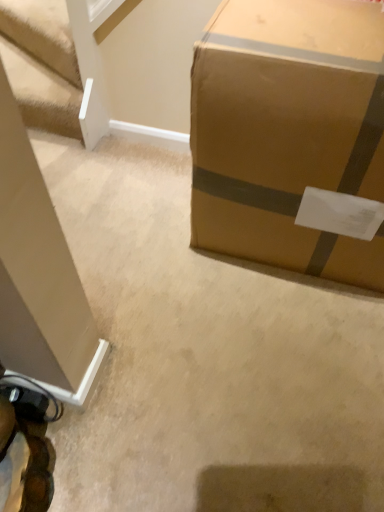
Locate an element on the screen. This screenshot has height=512, width=384. free space in front of brown cardboard box at right is located at coordinates (270, 357).